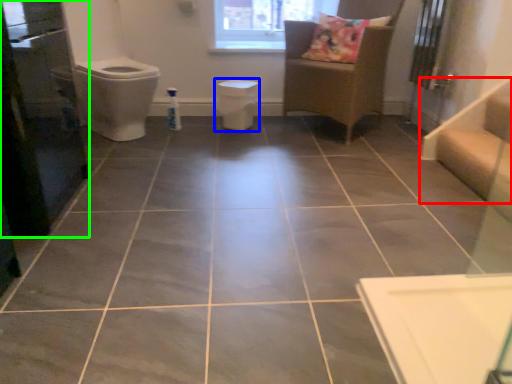
Question: Considering the real-world distances, which object is closest to stairwell (highlighted by a red box)? toilet bowl (highlighted by a blue box) or screen door (highlighted by a green box).

Choices:
 (A) toilet bowl
 (B) screen door

Answer: (A)